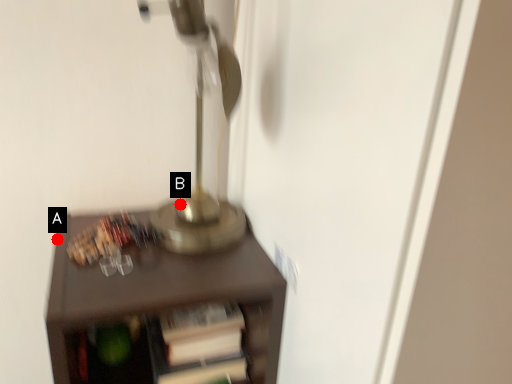
Question: Two points are circled on the image, labeled by A and B beside each circle. Which point is closer to the camera taking this photo?

Choices:
 (A) A is closer
 (B) B is closer

Answer: (B)